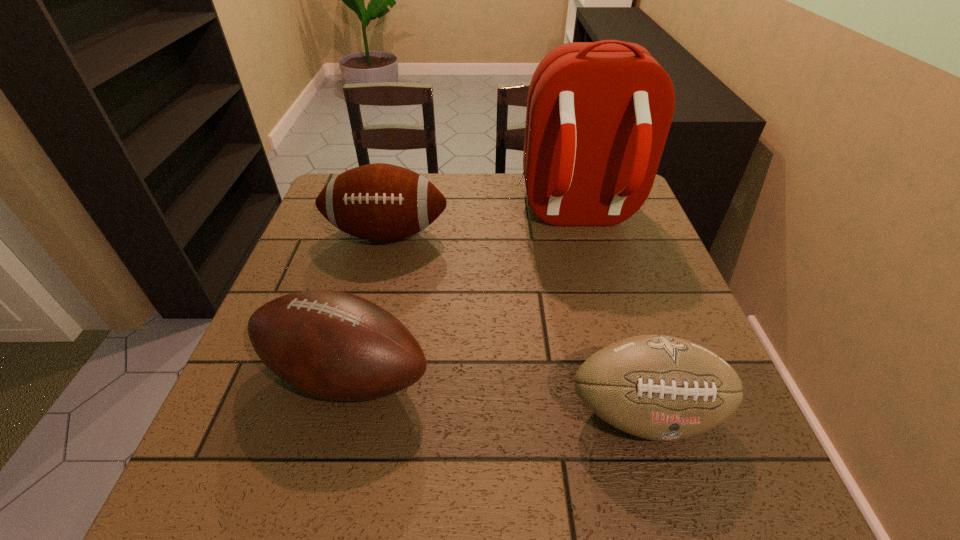
What are the coordinates of `backpack` in the screenshot? It's located at (598, 114).

The image size is (960, 540). I want to click on the farthest football (American), so coord(379,202).

This screenshot has width=960, height=540. I want to click on the rightmost football (American), so click(657, 387).

You are a GUI agent. You are given a task and a screenshot of the screen. Output one action in this format:
    pyautogui.click(x=<x>, y=<y>)
    Task: Click on the vacant space located on the strap side of the tallest object
    This screenshot has width=960, height=540.
    Given the screenshot: What is the action you would take?
    pyautogui.click(x=599, y=299)

Find the location of a particular element. This screenshot has height=540, width=960. vacant region located on the laces of the farthest football (American) is located at coordinates (358, 348).

The image size is (960, 540). In order to click on vacant position located on the laces of the rightmost football (American) in this screenshot , I will do `click(671, 498)`.

Identify the location of backpack that is at the far edge. Image resolution: width=960 pixels, height=540 pixels. (598, 114).

In order to click on football that is at the far edge in this screenshot , I will do [x=379, y=202].

Identify the location of object that is at the near edge. (657, 387).

Identify the location of backpack at the right edge. The width and height of the screenshot is (960, 540). (598, 114).